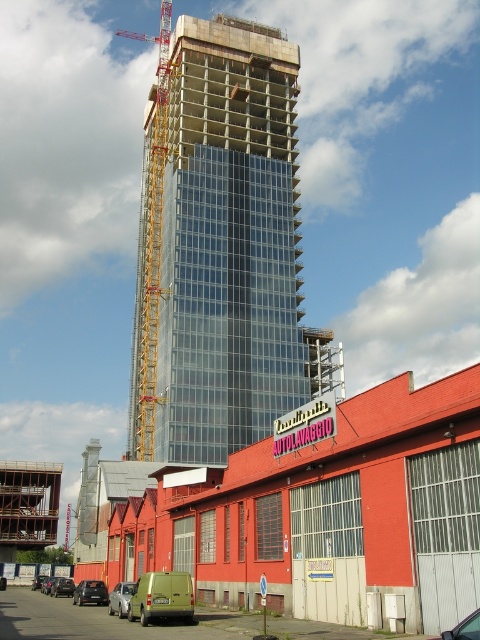
Does transparent glass tower at center appear on the left side of black matte car at lower left?

Yes, transparent glass tower at center is to the left of black matte car at lower left.

Based on the photo, who is lower down, transparent glass tower at center or black matte car at lower left?

black matte car at lower left is lower down.

Locate an element on the screen. Image resolution: width=480 pixels, height=640 pixels. transparent glass tower at center is located at coordinates (219, 248).

Between transparent glass tower at center and dark gray matte van at lower left, which one is positioned lower?

Positioned lower is dark gray matte van at lower left.

Between transparent glass tower at center and dark gray matte van at lower left, which one has more height?

With more height is transparent glass tower at center.

Is point (257, 428) more distant than point (39, 579)?

No, (257, 428) is closer to viewer.

At what (x,y) coordinates should I click in order to perform the action: click on transparent glass tower at center. Please return your answer as a coordinate pair (x, y). Image resolution: width=480 pixels, height=640 pixels. Looking at the image, I should click on (219, 248).

Between point (160, 173) and point (45, 577), which one is positioned behind?

The point (160, 173) is behind.

Is point (146, 435) positioned before point (36, 582)?

No.

Locate an element on the screen. This screenshot has width=480, height=640. yellow metal crane at left is located at coordinates coord(149,252).